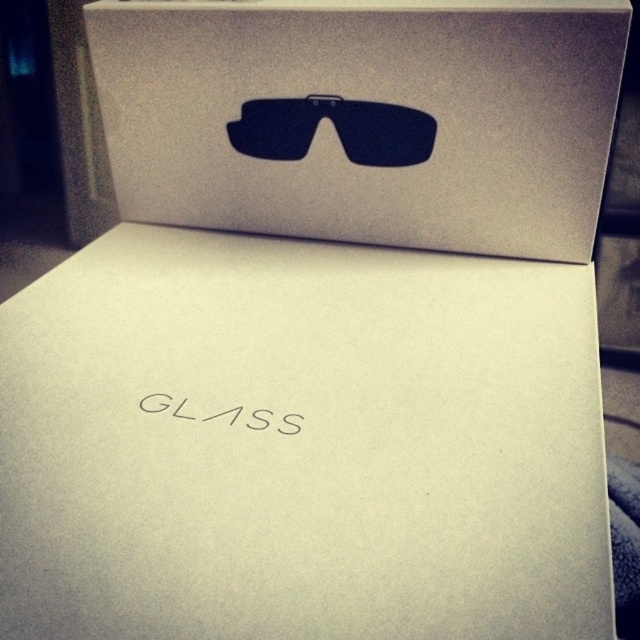
Is point (205, 188) closer to viewer compared to point (340, 144)?

No.

Can you confirm if white matte cardboard box at center is taller than matte black goggles at center?

Yes.

Where is `white matte cardboard box at center`? The image size is (640, 640). white matte cardboard box at center is located at coordinates (364, 118).